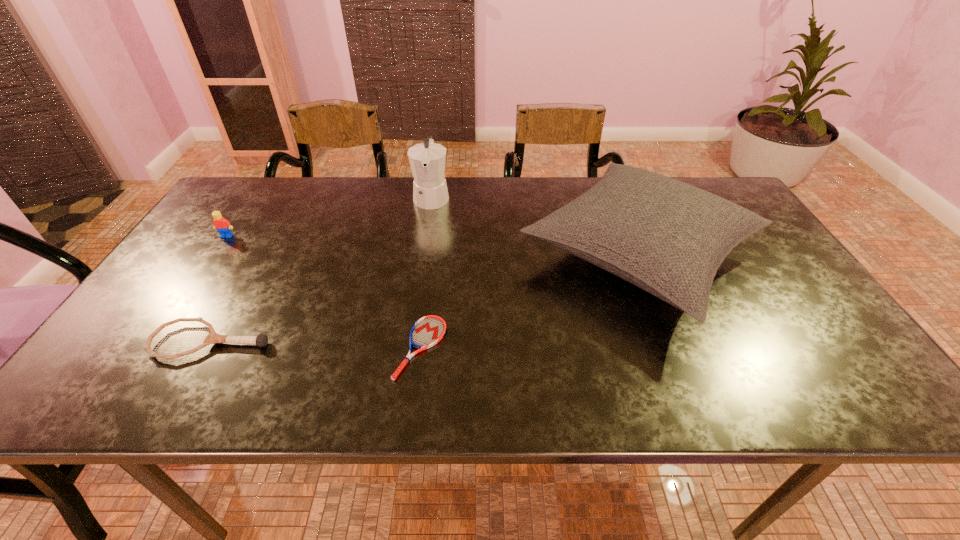
Find the location of a particular element. This screenshot has width=960, height=540. free area in between the second shortest object and the coffeepot is located at coordinates (322, 269).

At what (x,y) coordinates should I click in order to perform the action: click on empty space that is in between the right tennis racket and the second shortest object. Please return your answer as a coordinate pair (x, y). Looking at the image, I should click on (316, 345).

Locate an element on the screen. object that is the second closest to the Lego is located at coordinates (427, 160).

Where is `object that is the second nearest to the shorter tennis racket`? object that is the second nearest to the shorter tennis racket is located at coordinates (261, 340).

Locate an element on the screen. The image size is (960, 540). vacant space that satisfies the following two spatial constraints: 1. on the back side of the fourth tallest object; 2. on the right side of the rightmost object is located at coordinates 259,255.

The height and width of the screenshot is (540, 960). I want to click on free space that satisfies the following two spatial constraints: 1. on the back side of the right tennis racket; 2. on the right side of the cushion, so click(x=432, y=255).

Find the location of a particular element. The image size is (960, 540). vacant region that satisfies the following two spatial constraints: 1. at the spout of the right tennis racket; 2. on the right side of the coffeepot is located at coordinates (410, 348).

This screenshot has width=960, height=540. I want to click on free space that satisfies the following two spatial constraints: 1. on the face of the third shortest object; 2. on the right side of the shorter tennis racket, so click(x=151, y=348).

The image size is (960, 540). In order to click on free spot that satisfies the following two spatial constraints: 1. on the face of the Lego; 2. on the right side of the right tennis racket in this screenshot , I will do `click(151, 348)`.